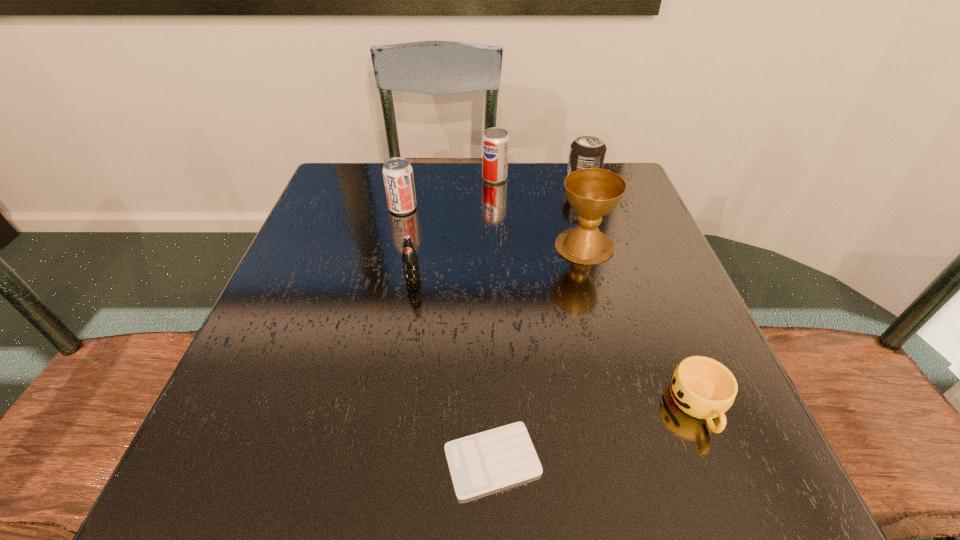
Find the location of a particular element. This screenshot has height=540, width=960. the tallest object is located at coordinates [592, 192].

Identify the location of chalice. The image size is (960, 540). (592, 192).

The height and width of the screenshot is (540, 960). I want to click on the second pop from right to left, so click(495, 141).

In order to click on the leftmost pop in this screenshot , I will do [397, 172].

This screenshot has height=540, width=960. Identify the location of the fifth nearest object. (397, 172).

In order to click on the rightmost pop in this screenshot , I will do `click(588, 150)`.

Identify the location of the third nearest object. (410, 260).

Locate an element on the screen. The width and height of the screenshot is (960, 540). the nearest pop is located at coordinates (410, 260).

In order to click on the second shortest object in this screenshot , I will do `click(702, 387)`.

In order to click on the shortest object in this screenshot , I will do [483, 462].